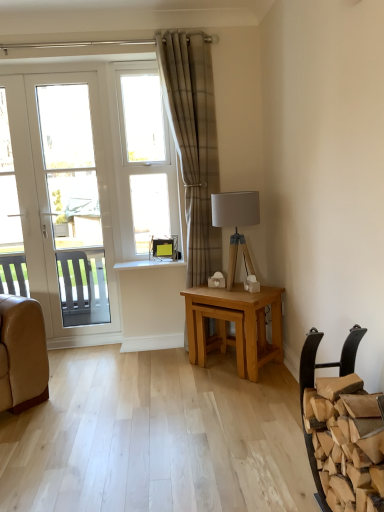
You are a GUI agent. You are given a task and a screenshot of the screen. Output one action in this format:
    pyautogui.click(x=<x>, y=<y>)
    Task: Click on the free space above plaid fabric curtain at center (from a real-world perspective)
    This screenshot has width=384, height=512.
    Given the screenshot: What is the action you would take?
    pyautogui.click(x=190, y=30)